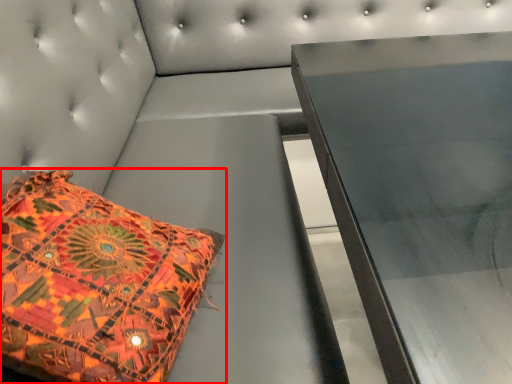
Question: From the image's perspective, what is the correct spatial positioning of pillow (annotated by the red box) in reference to furniture?

Choices:
 (A) above
 (B) below

Answer: (A)